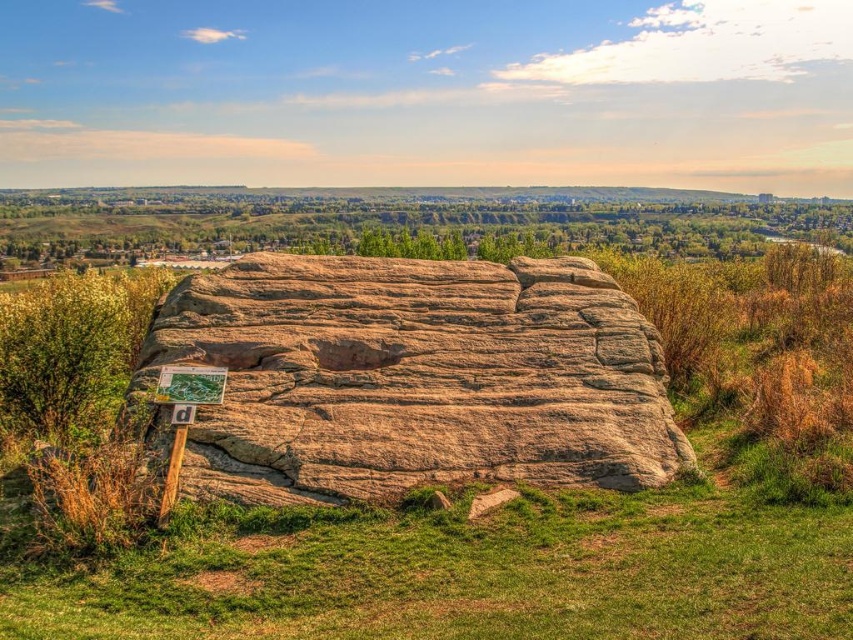
Between green grassy at center and brown textured rock at center, which one appears on the left side from the viewer's perspective?

From the viewer's perspective, brown textured rock at center appears more on the left side.

Can you confirm if green grassy at center is bigger than brown textured rock at center?

No, green grassy at center is not bigger than brown textured rock at center.

Is point (740, 548) farther from camera compared to point (526, 307)?

No, (740, 548) is closer to viewer.

Where is `green grassy at center`? The image size is (853, 640). green grassy at center is located at coordinates (468, 570).